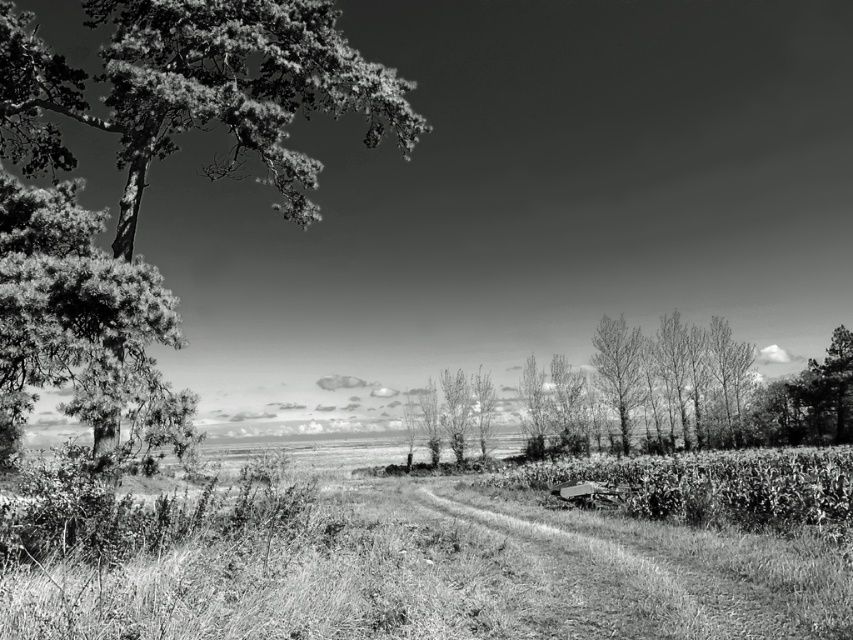
Is thick textured pine tree at left positioned before smooth bark trees at center?

Yes, thick textured pine tree at left is in front of smooth bark trees at center.

Does thick textured pine tree at left have a larger size compared to smooth bark trees at center?

No.

I want to click on thick textured pine tree at left, so click(x=80, y=321).

Between point (712, 634) and point (763, 401), which one is positioned in front?

Positioned in front is point (712, 634).

Between grassy field at center and smooth bark trees at center, which one has more height?

Standing taller between the two is smooth bark trees at center.

Which is behind, point (173, 525) or point (712, 403)?

Positioned behind is point (712, 403).

Locate an element on the screen. This screenshot has width=853, height=640. grassy field at center is located at coordinates (454, 561).

Is point (271, 61) positioned in front of point (517, 516)?

Yes.

Between point (142, 90) and point (722, 563), which one is positioned behind?

The point (142, 90) is more distant.

The height and width of the screenshot is (640, 853). Find the location of `dark green textured tree at left`. dark green textured tree at left is located at coordinates (198, 90).